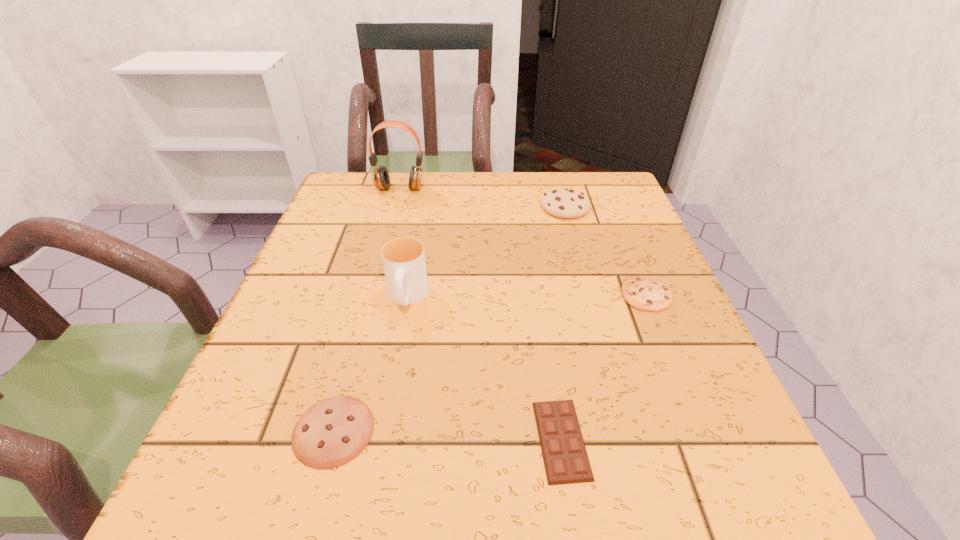
Select which object is the fourth closest to the leftmost cookie. Please provide its 2D coordinates. Your answer should be formatted as a tuple, i.e. [(x, y)], where the tuple contains the x and y coordinates of a point satisfying the conditions above.

[(564, 203)]

Locate an element on the screen. cookie that is the closest one to the tallest cookie is located at coordinates (646, 293).

The height and width of the screenshot is (540, 960). Find the location of `cookie that stands as the third closest to the farthest object`. cookie that stands as the third closest to the farthest object is located at coordinates (332, 432).

Where is `free space that satisfies the following two spatial constraints: 1. on the ear cups of the second nearest cookie; 2. on the left side of the tallest object`? This screenshot has width=960, height=540. free space that satisfies the following two spatial constraints: 1. on the ear cups of the second nearest cookie; 2. on the left side of the tallest object is located at coordinates click(372, 294).

Find the location of a particular element. This screenshot has width=960, height=540. vacant space that satisfies the following two spatial constraints: 1. on the ear cups of the farthest cookie; 2. on the left side of the tallest object is located at coordinates (395, 207).

Identify the location of free space that satisfies the following two spatial constraints: 1. on the ear cups of the farthest object; 2. on the right side of the tallest cookie. The width and height of the screenshot is (960, 540). pyautogui.click(x=395, y=207).